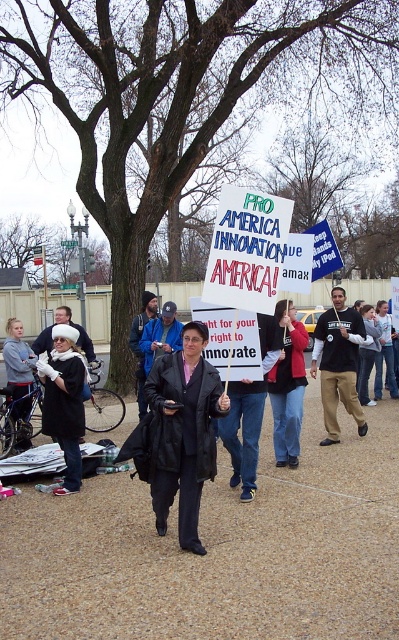
What are the coordinates of the white fur hat at left?

The white fur hat at left is located at coordinates point (x=65, y=401).